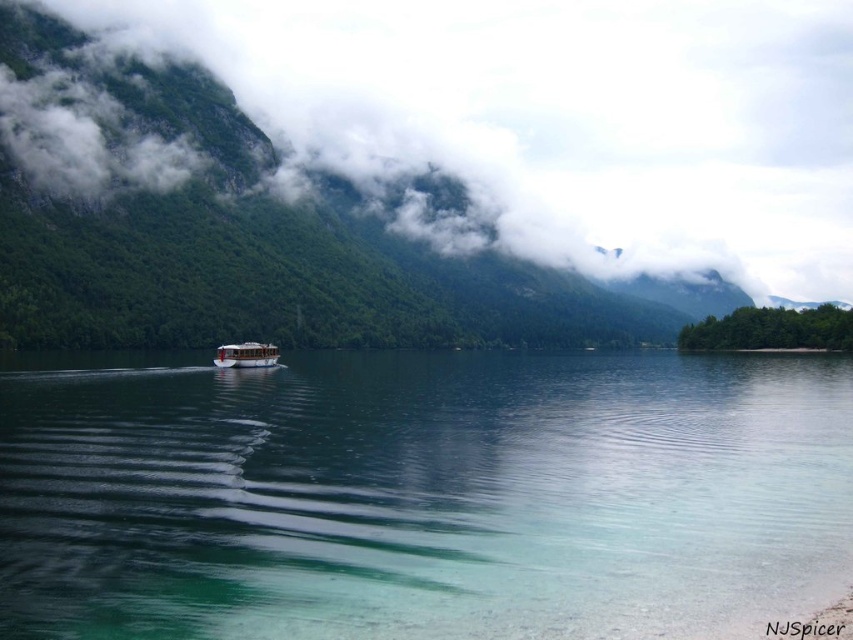
Does white fluffy cloud at upper center have a lesser height compared to white wooden boat at center?

No, white fluffy cloud at upper center is not shorter than white wooden boat at center.

Is point (612, 102) positioned before point (238, 368)?

No.

The image size is (853, 640). What are the coordinates of `white fluffy cloud at upper center` in the screenshot? It's located at (558, 118).

Which of these two, clear water at center or white wooden boat at center, stands shorter?

With less height is clear water at center.

Does clear water at center have a greater height compared to white wooden boat at center?

No.

What do you see at coordinates (416, 493) in the screenshot? The height and width of the screenshot is (640, 853). I see `clear water at center` at bounding box center [416, 493].

Locate an element on the screen. The width and height of the screenshot is (853, 640). clear water at center is located at coordinates (416, 493).

In the scene shown: Can you confirm if clear water at center is thinner than white fluffy cloud at upper center?

Yes.

Can you confirm if clear water at center is taller than white fluffy cloud at upper center?

No, clear water at center is not taller than white fluffy cloud at upper center.

Which is in front, point (752, 401) or point (654, 179)?

Point (752, 401)

You are a GUI agent. You are given a task and a screenshot of the screen. Output one action in this format:
    pyautogui.click(x=<x>, y=<y>)
    Task: Click on the clear water at center
    Image resolution: width=853 pixels, height=640 pixels.
    Given the screenshot: What is the action you would take?
    pyautogui.click(x=416, y=493)